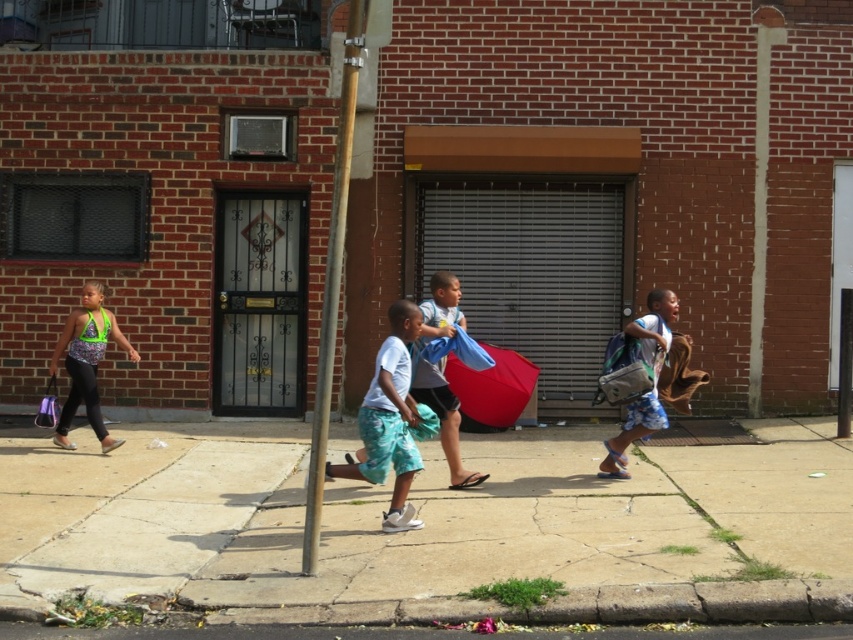
You are standing on the sidewalk and want to reach a specific point marked at coordinates point (x=247, y=396). If your current position is 10 meters away from that point, how much farther do you need to walk to reach it?

The distance of point (x=247, y=396) from viewer is 11.90 meters. Since you are currently 10 meters away, you need to walk an additional 1.90 meters to reach it.